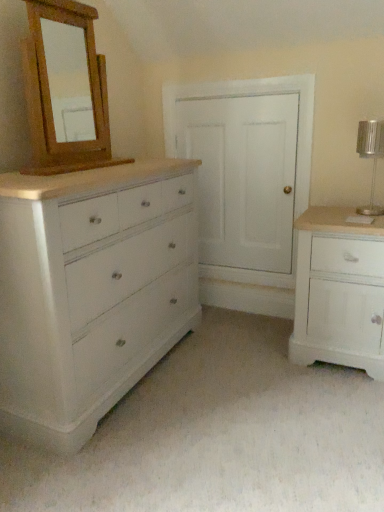
Question: Considering the positions of point (372, 144) and point (51, 104), is point (372, 144) closer or farther from the camera than point (51, 104)?

Choices:
 (A) closer
 (B) farther

Answer: (A)

Question: Is silver metallic table lamp at right to the left or to the right of wooden mirror at upper left in the image?

Choices:
 (A) right
 (B) left

Answer: (A)

Question: Estimate the real-world distances between objects in this image. Which object is farther from the white painted wood cabinet at right, arranged as the 2th chest of drawers when viewed from the left?

Choices:
 (A) wooden mirror at upper left
 (B) silver metallic table lamp at right
 (C) white painted wood chest of drawers at left, marked as the second chest of drawers in a right-to-left arrangement

Answer: (A)

Question: Which object is the closest to the white painted wood cabinet at right, arranged as the 2th chest of drawers when viewed from the left?

Choices:
 (A) white painted wood chest of drawers at left, the 1th chest of drawers viewed from the left
 (B) silver metallic table lamp at right
 (C) wooden mirror at upper left

Answer: (B)